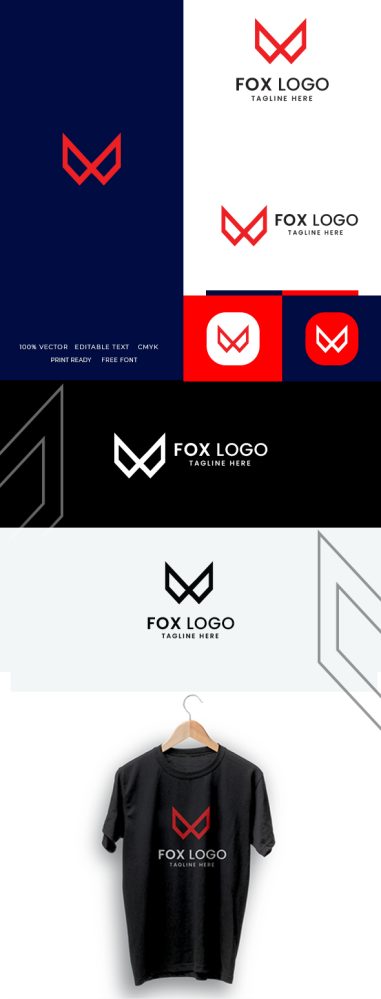
Identify the location of clothes hanger. point(198,730).